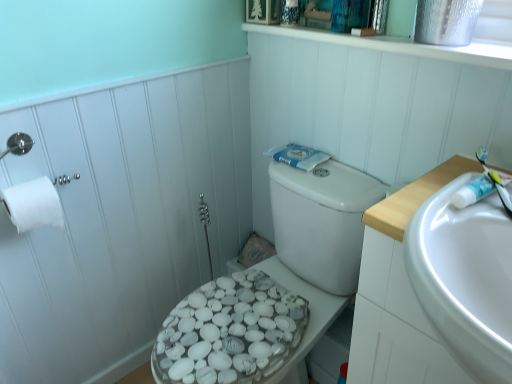
Question: Can we say white matte toilet paper at left lies outside white glossy sink at right?

Choices:
 (A) no
 (B) yes

Answer: (B)

Question: Can you confirm if white matte toilet paper at left is taller than white glossy sink at right?

Choices:
 (A) yes
 (B) no

Answer: (B)

Question: Is white matte toilet paper at left not close to white glossy sink at right?

Choices:
 (A) no
 (B) yes

Answer: (A)

Question: Is white matte toilet paper at left positioned before white glossy sink at right?

Choices:
 (A) yes
 (B) no

Answer: (B)

Question: From the image's perspective, is white matte toilet paper at left on top of white glossy sink at right?

Choices:
 (A) no
 (B) yes

Answer: (B)

Question: Can you confirm if white matte toilet paper at left is wider than white glossy sink at right?

Choices:
 (A) yes
 (B) no

Answer: (B)

Question: Is white plastic toothbrush at right looking in the opposite direction of white glossy porcelain at center?

Choices:
 (A) no
 (B) yes

Answer: (A)

Question: From the image's perspective, is white plastic toothbrush at right under white glossy porcelain at center?

Choices:
 (A) no
 (B) yes

Answer: (A)

Question: Is white plastic toothbrush at right not close to white glossy porcelain at center?

Choices:
 (A) no
 (B) yes

Answer: (A)

Question: Could you tell me if white plastic toothbrush at right is facing white glossy porcelain at center?

Choices:
 (A) no
 (B) yes

Answer: (A)

Question: Does white plastic toothbrush at right come in front of white glossy porcelain at center?

Choices:
 (A) yes
 (B) no

Answer: (A)

Question: Is white plastic toothbrush at right located outside white glossy porcelain at center?

Choices:
 (A) no
 (B) yes

Answer: (B)

Question: Is white matte toilet paper at left taller than white pebble-patterned toilet seat at left?

Choices:
 (A) no
 (B) yes

Answer: (A)